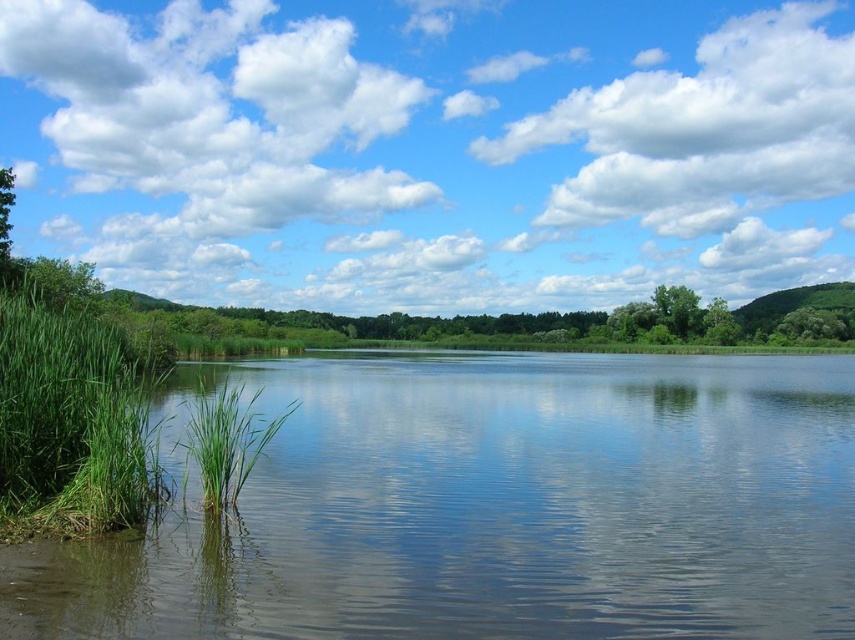
Question: Estimate the real-world distances between objects in this image. Which object is closer to the green grassy river at left?

Choices:
 (A) green leafy tree at left
 (B) green leafy grass at left
 (C) green matte grass at lower left

Answer: (C)

Question: Among these objects, which one is nearest to the camera?

Choices:
 (A) green leafy grass at left
 (B) white fluffy cloud at upper center
 (C) green leafy tree at center

Answer: (A)

Question: Can you confirm if green leafy tree at right is wider than green leafy tree at left?

Choices:
 (A) no
 (B) yes

Answer: (B)

Question: Estimate the real-world distances between objects in this image. Which object is farther from the green matte grass at lower left?

Choices:
 (A) green leafy tree at center
 (B) green grassy river at left

Answer: (A)

Question: Can you confirm if green leafy grass at left is smaller than green matte grass at lower left?

Choices:
 (A) no
 (B) yes

Answer: (A)

Question: Can you confirm if green leafy tree at right is bigger than green leafy tree at left?

Choices:
 (A) no
 (B) yes

Answer: (B)